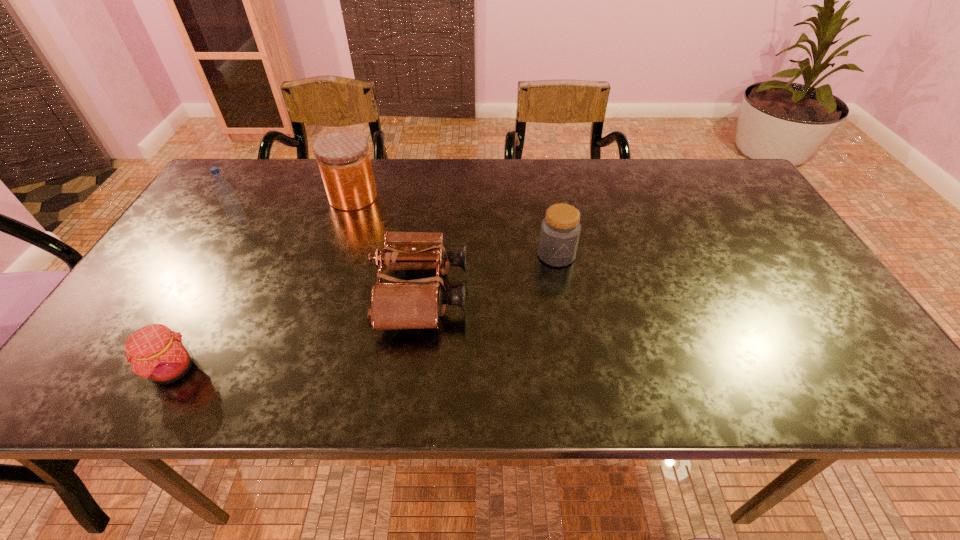
Find the location of a particular element. The width and height of the screenshot is (960, 540). free point located 0.060m on the surface of the nearer jar near the warning symbol is located at coordinates (562, 286).

Find the location of `vacant space located through the eyepieces of the second object from right to left`. vacant space located through the eyepieces of the second object from right to left is located at coordinates (526, 293).

Locate an element on the screen. This screenshot has height=540, width=960. free point located on the right of the shortest object is located at coordinates (264, 369).

Find the location of a particular element. The width and height of the screenshot is (960, 540). object at the far edge is located at coordinates (x=343, y=158).

Image resolution: width=960 pixels, height=540 pixels. I want to click on object positioned at the near edge, so click(x=156, y=353).

The height and width of the screenshot is (540, 960). I want to click on water bottle at the left edge, so click(223, 189).

Identify the location of jam that is at the left edge. click(156, 353).

This screenshot has height=540, width=960. I want to click on object positioned at the near left corner, so click(x=156, y=353).

Where is `vacant space at the far edge`? This screenshot has height=540, width=960. vacant space at the far edge is located at coordinates (322, 200).

This screenshot has height=540, width=960. In the image, there is a desktop. Find the location of `vacant space at the near edge`. vacant space at the near edge is located at coordinates (400, 387).